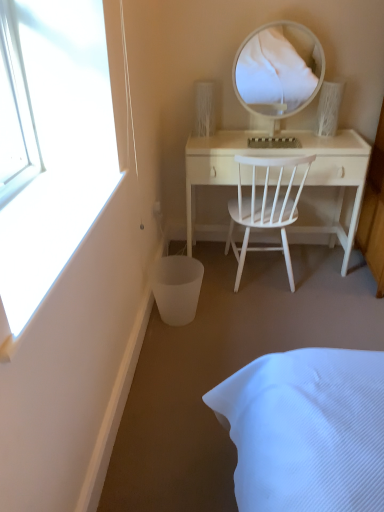
At what (x,y) coordinates should I click in order to perform the action: click on vacant area on top of white wood desk at center (from a real-world perspective). Please return your answer as a coordinate pair (x, y). Image resolution: width=384 pixels, height=512 pixels. Looking at the image, I should click on (270, 136).